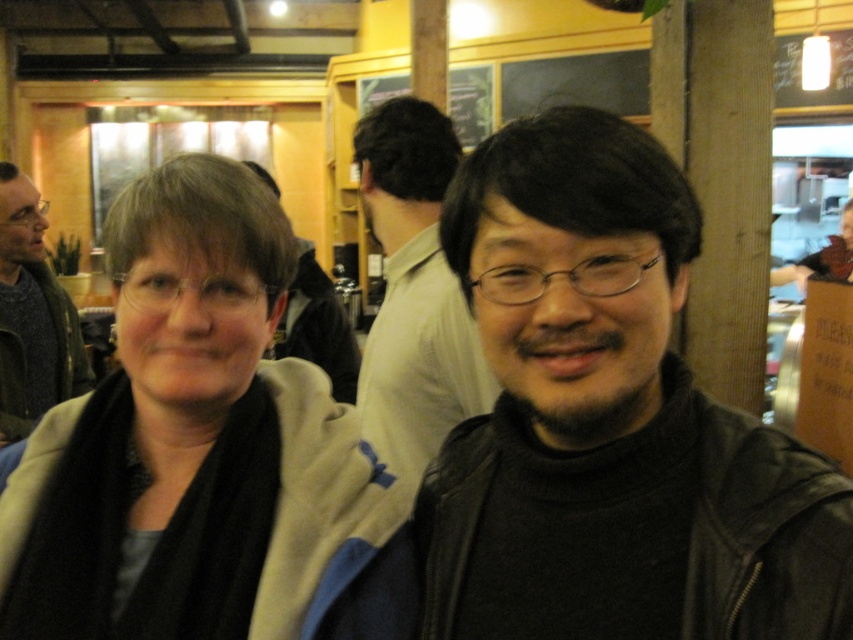
From the picture: Where is the beige fabric jacket at center located in the image?

The beige fabric jacket at center is located at point (201, 451).